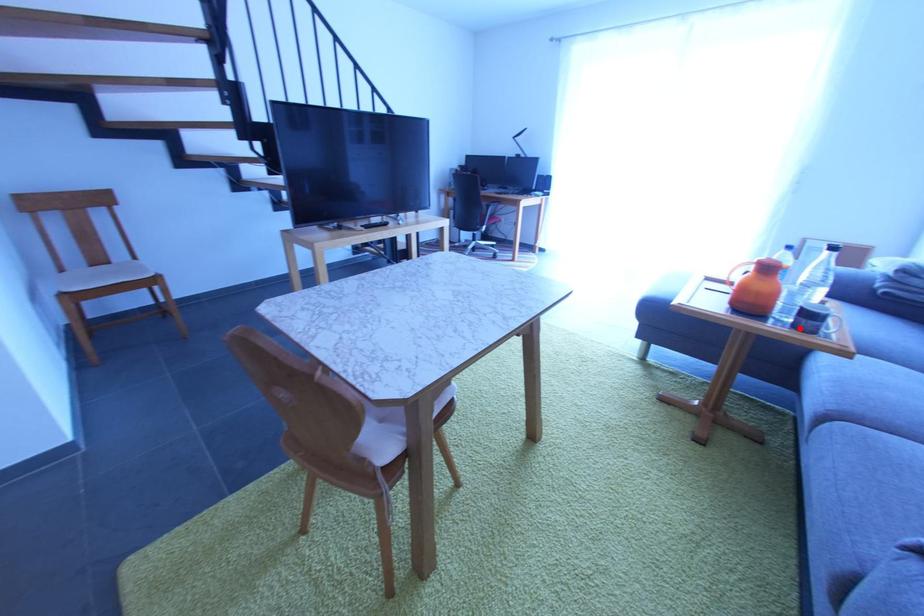
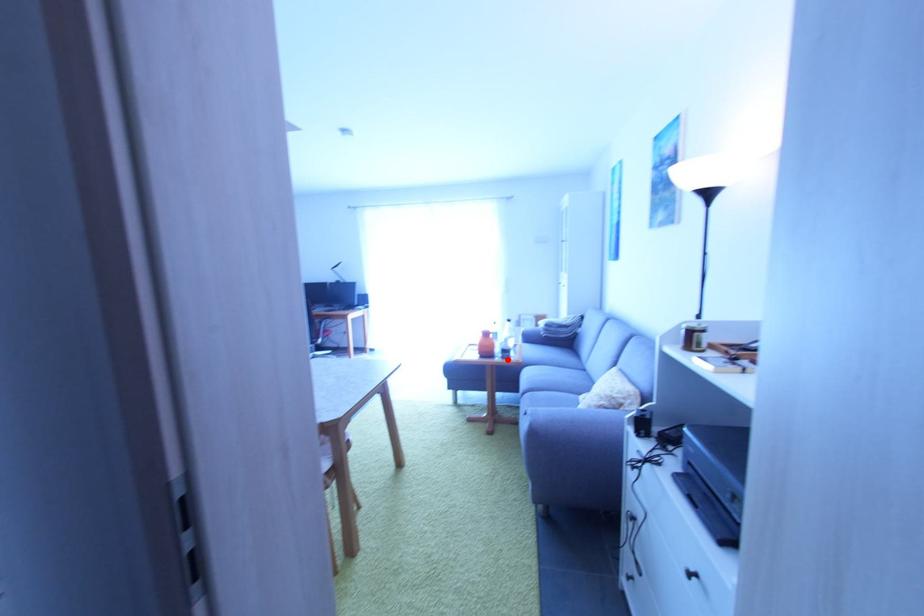
I am providing you with two images of the same scene from different viewpoints. A red point is marked on the first image and another point is marked on the second image. Does the point marked in image1 correspond to the same location as the one in image2?

Yes